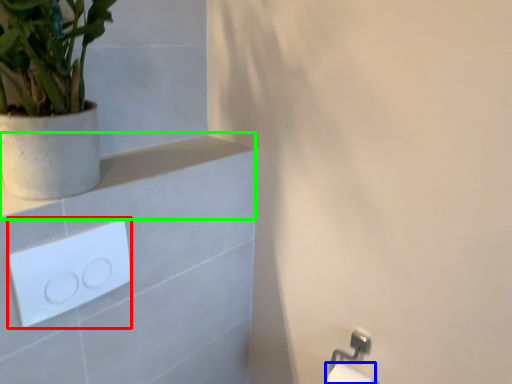
Question: Which is farther away from light switch (highlighted by a red box)? toilet paper (highlighted by a blue box) or balustrade (highlighted by a green box)?

Choices:
 (A) toilet paper
 (B) balustrade

Answer: (A)